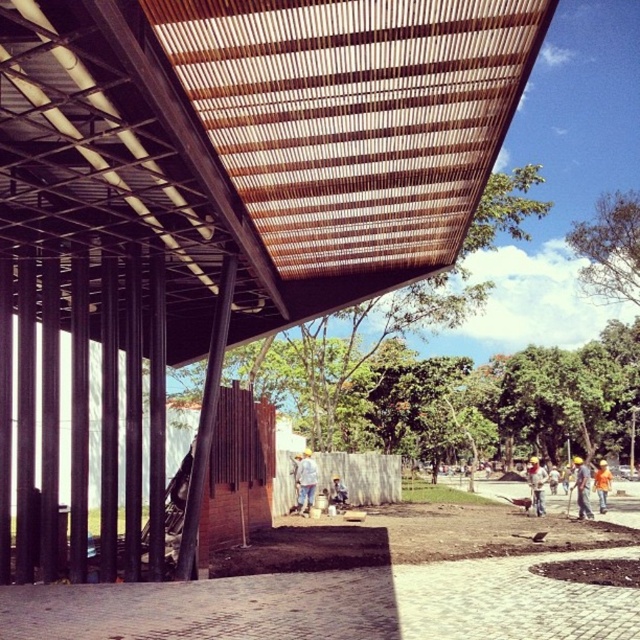
Does orange fabric at lower right appear under blue denim jeans at center?

Correct, orange fabric at lower right is located below blue denim jeans at center.

Measure the distance between orange fabric at lower right and blue denim jeans at center.

orange fabric at lower right is 36.10 feet from blue denim jeans at center.

Which is behind, point (605, 468) or point (340, 492)?

Positioned behind is point (605, 468).

This screenshot has width=640, height=640. Identify the location of orange fabric at lower right. (602, 484).

From the picture: Is brown corrugated metal roof at upper center to the left of blue denim jeans at center from the viewer's perspective?

Indeed, brown corrugated metal roof at upper center is positioned on the left side of blue denim jeans at center.

Can you confirm if brown corrugated metal roof at upper center is positioned below blue denim jeans at center?

Actually, brown corrugated metal roof at upper center is above blue denim jeans at center.

Image resolution: width=640 pixels, height=640 pixels. Describe the element at coordinates (259, 138) in the screenshot. I see `brown corrugated metal roof at upper center` at that location.

Where is `brown corrugated metal roof at upper center`? Image resolution: width=640 pixels, height=640 pixels. brown corrugated metal roof at upper center is located at coordinates (259, 138).

Does white fabric shirt at center appear on the right side of orange fabric at lower right?

No, white fabric shirt at center is not to the right of orange fabric at lower right.

Who is more distant from viewer, (310,470) or (604,460)?

Point (604,460)

Is point (305, 476) less distant than point (602, 476)?

Yes.

Where is `white fabric shirt at center`? The height and width of the screenshot is (640, 640). white fabric shirt at center is located at coordinates (305, 481).